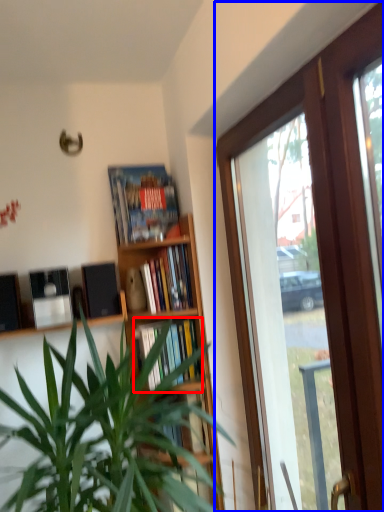
Question: Which object appears farthest to the camera in this image, book (highlighted by a red box) or window (highlighted by a blue box)?

Choices:
 (A) book
 (B) window

Answer: (A)